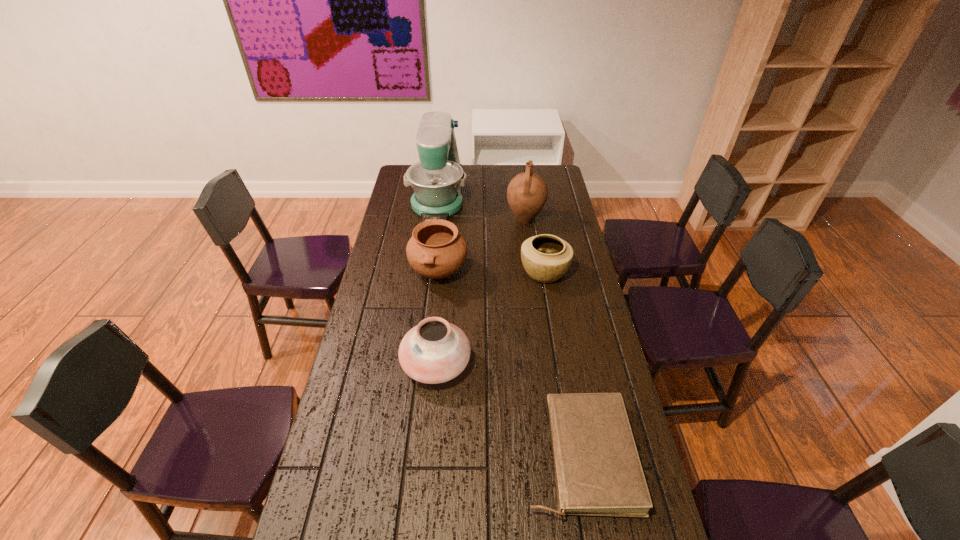
This screenshot has width=960, height=540. Identify the location of object that is at the far left corner. (437, 179).

At what (x,y) coordinates should I click in order to perform the action: click on vacant space at the left edge of the desktop. Please return your answer as a coordinate pair (x, y). The height and width of the screenshot is (540, 960). Looking at the image, I should click on (378, 343).

Image resolution: width=960 pixels, height=540 pixels. Find the location of `vacant space at the right edge`. vacant space at the right edge is located at coordinates (584, 316).

What are the coordinates of `vacant space at the far left corner of the desktop` in the screenshot? It's located at (395, 186).

I want to click on free space between the nearest pottery and the shortest object, so click(x=508, y=410).

At what (x,y) coordinates should I click in order to perform the action: click on free space between the rightmost pottery and the paperback book. Please return your answer as a coordinate pair (x, y). The image size is (960, 540). Looking at the image, I should click on (563, 364).

You are a GUI agent. You are given a task and a screenshot of the screen. Output one action in this format:
    pyautogui.click(x=<x>, y=<y>)
    Task: Click on the empty location between the nearest pottery and the nearest object
    This screenshot has height=540, width=960.
    Given the screenshot: What is the action you would take?
    pyautogui.click(x=508, y=410)

I want to click on free space that is in between the fifth farthest object and the second shortest object, so click(491, 318).

You are a GUI agent. You are given a task and a screenshot of the screen. Output one action in this format:
    pyautogui.click(x=<x>, y=<y>)
    Task: Click on the free space between the mixer and the nearest pottery
    This screenshot has height=540, width=960.
    Given the screenshot: What is the action you would take?
    pyautogui.click(x=438, y=279)

Find the location of a particular element. This screenshot has height=540, width=960. empty space that is in between the fifth shortest object and the nearest pottery is located at coordinates (481, 292).